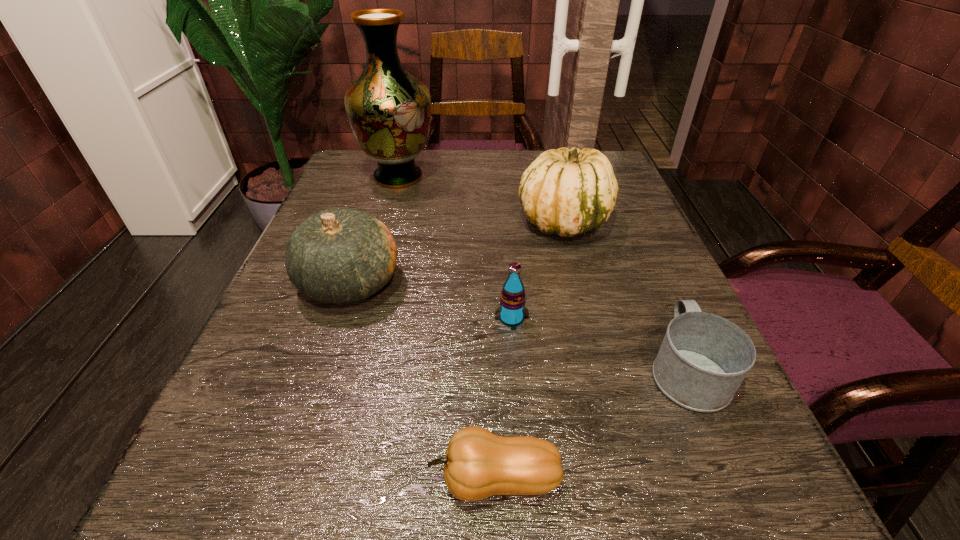
Locate an element on the screen. The image size is (960, 540). free space between the soda and the tallest object is located at coordinates (455, 247).

Select which object appears as the second closest to the soda. Please provide its 2D coordinates. Your answer should be formatted as a tuple, i.e. [(x, y)], where the tuple contains the x and y coordinates of a point satisfying the conditions above.

[(340, 256)]

Identify which object is located as the third nearest to the nearest object. Please provide its 2D coordinates. Your answer should be formatted as a tuple, i.e. [(x, y)], where the tuple contains the x and y coordinates of a point satisfying the conditions above.

[(340, 256)]

In order to click on gourd object that ranks as the second closest to the tallest object in this screenshot , I will do `click(340, 256)`.

Find the location of a particular element. The height and width of the screenshot is (540, 960). gourd that stands as the third closest to the soda is located at coordinates (478, 464).

Where is `vacant space that satisfies the following two spatial constraints: 1. on the back side of the farthest gourd; 2. on the left side of the third shortest object`? vacant space that satisfies the following two spatial constraints: 1. on the back side of the farthest gourd; 2. on the left side of the third shortest object is located at coordinates (504, 221).

Locate an element on the screen. The height and width of the screenshot is (540, 960). vacant space that satisfies the following two spatial constraints: 1. on the back side of the vase; 2. on the right side of the second farthest gourd is located at coordinates (385, 177).